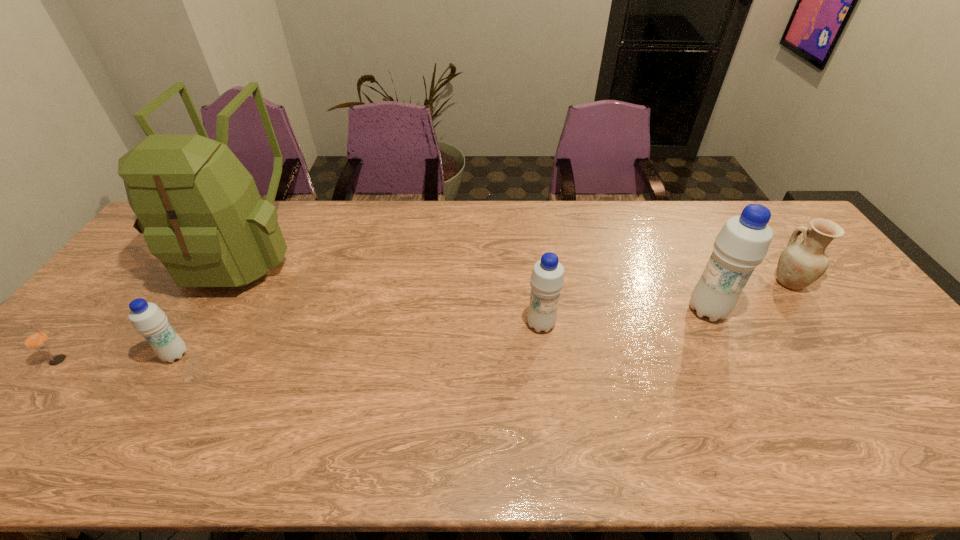
Locate an element on the screen. The image size is (960, 540). object situated at the far left corner is located at coordinates (199, 209).

Where is `vacant space at the far edge`? The width and height of the screenshot is (960, 540). vacant space at the far edge is located at coordinates (313, 200).

You are a GUI agent. You are given a task and a screenshot of the screen. Output one action in this format:
    pyautogui.click(x=<x>, y=<y>)
    Task: Click on the blank area at the near edge
    The height and width of the screenshot is (540, 960).
    Given the screenshot: What is the action you would take?
    pyautogui.click(x=168, y=394)

The width and height of the screenshot is (960, 540). In the image, there is a desktop. What are the coordinates of `blank space at the left edge` in the screenshot? It's located at (141, 255).

In the image, there is a desktop. Where is `vacant space at the right edge`? The width and height of the screenshot is (960, 540). vacant space at the right edge is located at coordinates (923, 379).

Locate an element on the screen. This screenshot has height=540, width=960. vacant space that is in between the leftmost object and the rightmost water bottle is located at coordinates (383, 335).

The height and width of the screenshot is (540, 960). Find the location of `free spot between the second tallest object and the leftmost water bottle`. free spot between the second tallest object and the leftmost water bottle is located at coordinates (442, 333).

Where is `empty location between the tallest object and the rightmost object`? The width and height of the screenshot is (960, 540). empty location between the tallest object and the rightmost object is located at coordinates (516, 267).

This screenshot has width=960, height=540. What are the coordinates of `vacant space in between the backpack and the rightmost object` in the screenshot? It's located at (516, 267).

This screenshot has width=960, height=540. I want to click on vacant space that's between the tallest object and the fourth object from left to right, so click(393, 288).